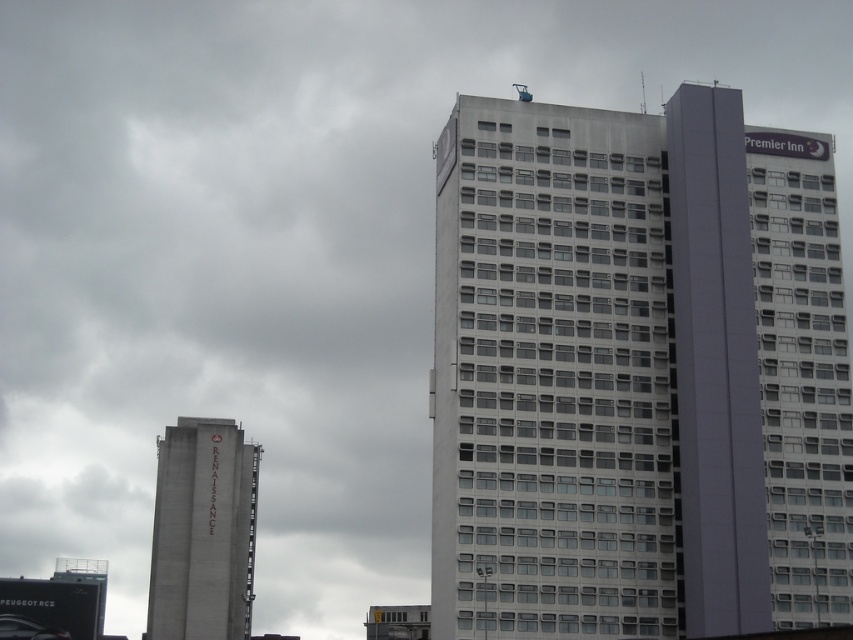
Question: Is white glass building at center below concrete tower at left?

Choices:
 (A) yes
 (B) no

Answer: (B)

Question: Can you confirm if white glass building at center is wider than concrete tower at left?

Choices:
 (A) yes
 (B) no

Answer: (B)

Question: Which point appears closest to the camera in this image?

Choices:
 (A) (849, 390)
 (B) (202, 445)

Answer: (A)

Question: Is white glass building at center below concrete tower at left?

Choices:
 (A) yes
 (B) no

Answer: (B)